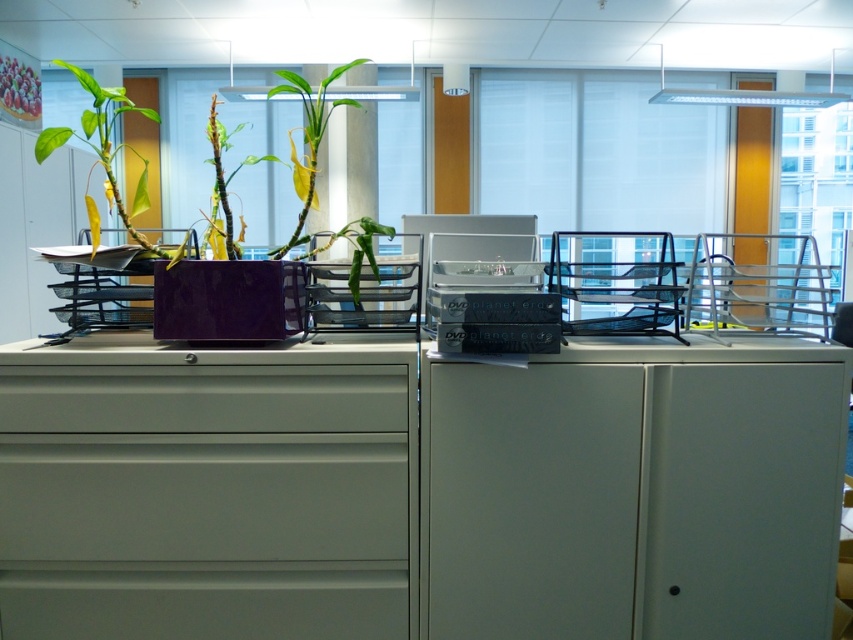
You are an office worker who needs to locate the matte gray file cabinet at center. According to the office layout, where would you find it in terms of coordinates?

The matte gray file cabinet at center is located at coordinates point (x=207, y=490).

You are organizing your desk and need to place a stack of papers. The stack is 10 cm tall. You have two options on your desk, the matte gray drawer at center and the matte purple planter at left. Which one can accommodate the stack based on their heights?

The matte purple planter at left has a greater height than the matte gray drawer at center, so the stack of papers will fit in the matte purple planter at left.

You are standing in the office and need to locate the exact position of the point marked at coordinates (202, 397). Based on the scene description, which object is this point located on?

The point at coordinates (202, 397) is located on the matte gray drawer at center.